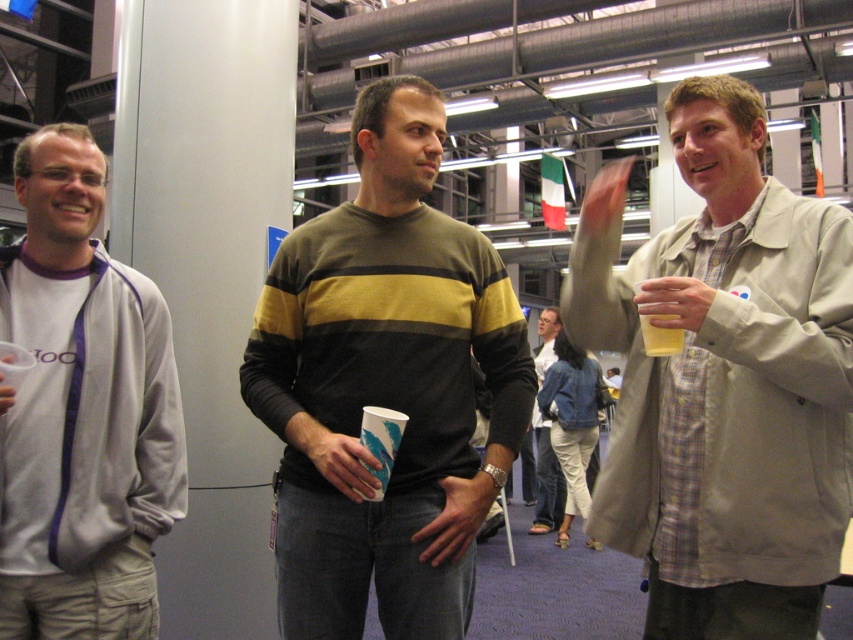
You are organizing a photo shoot and need to place two models wearing the striped sweater at center and denim jacket at center in the frame. Based on their sizes, which model should be positioned closer to the camera to maintain visual balance?

The striped sweater at center is smaller than the denim jacket at center, so placing the model in the striped sweater at center closer to the camera will help balance their visual sizes in the frame.

You are at a social gathering and need to identify which object is taller between the striped sweater at center and the yellow matte cup at right. Based on the scene description, which one is taller?

The striped sweater at center is taller than the yellow matte cup at right.

You are at a social gathering and want to get a drink from the refreshment area. You see the striped sweater at center and the yellow matte cup at right. Which object is closer to the refreshment area?

The yellow matte cup at right is closer to the refreshment area because it is to the right of the striped sweater at center, which might indicate it is nearer to where drinks are served.